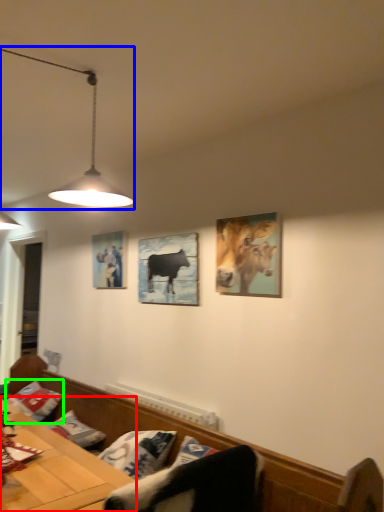
Question: Which is nearer to the table (highlighted by a red box)? lamp (highlighted by a blue box) or pillow (highlighted by a green box).

Choices:
 (A) lamp
 (B) pillow

Answer: (B)